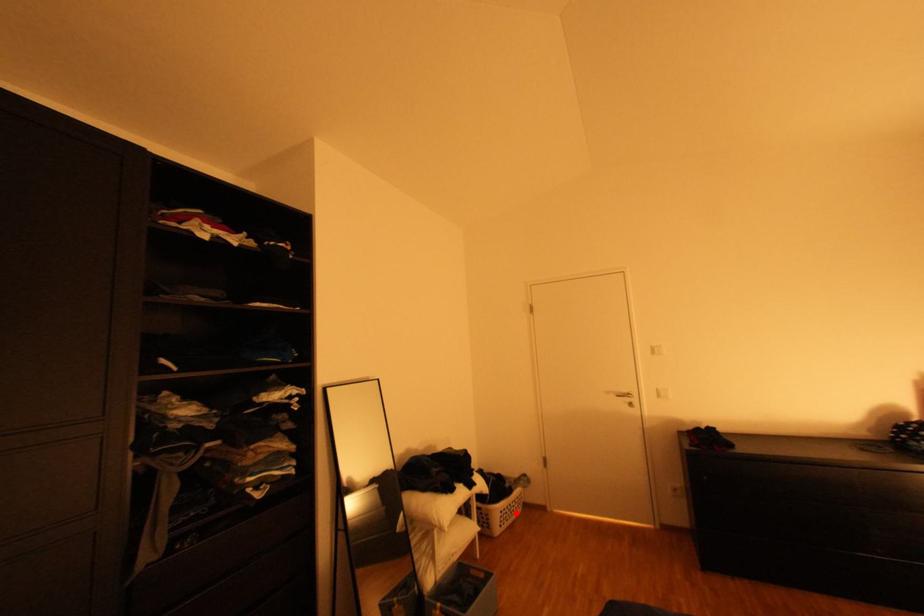
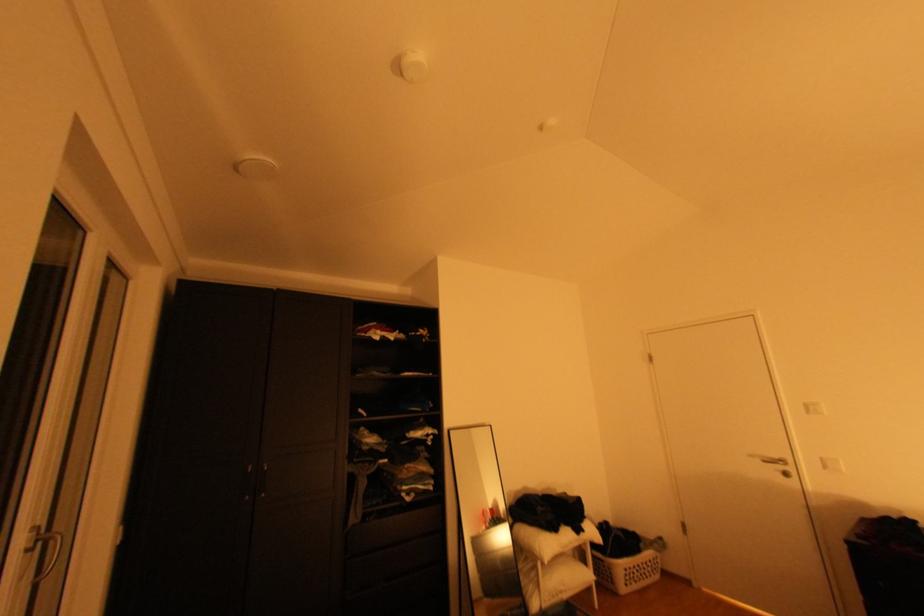
Where in the second image is the point corresponding to the highlighted location from the first image?

(642, 573)